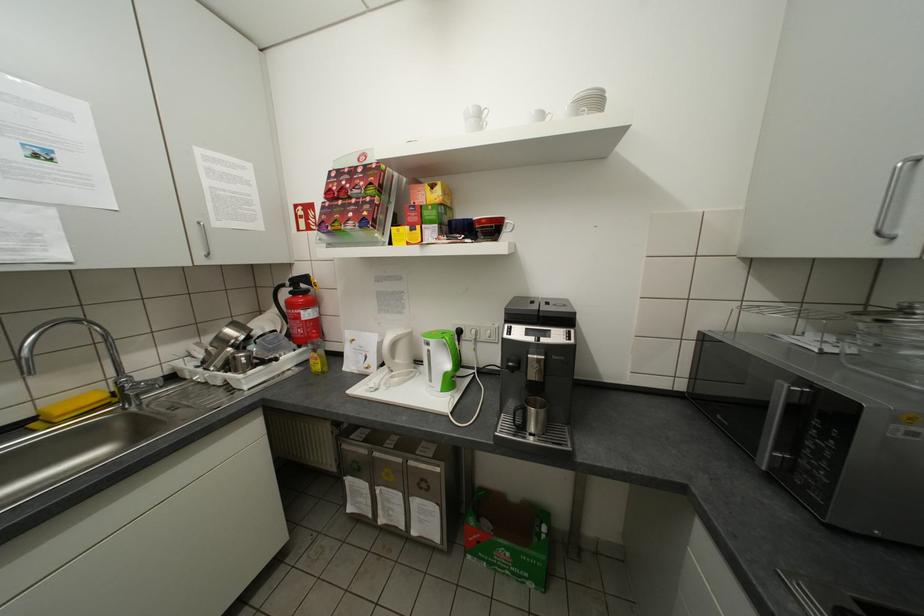
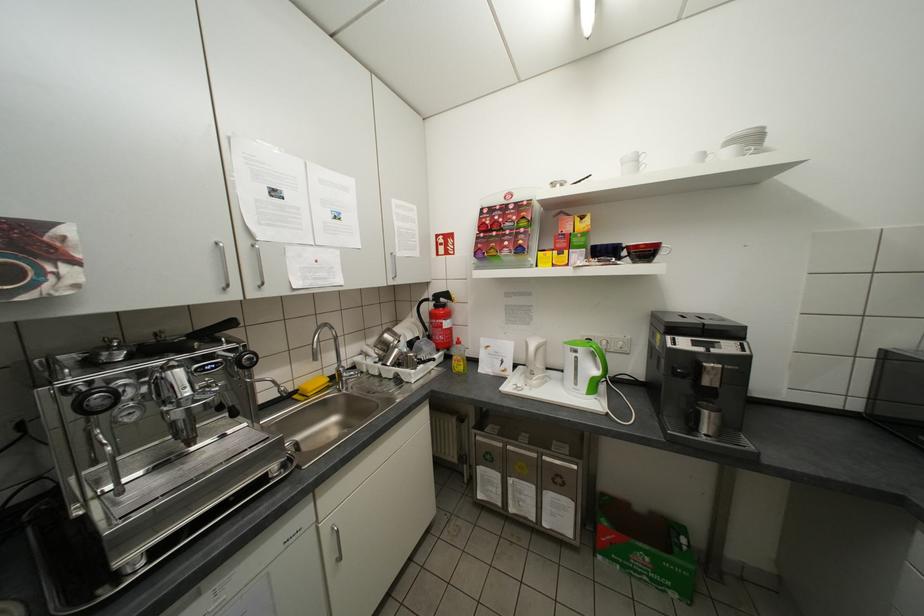
The point at (67, 413) is marked in the first image. Where is the corresponding point in the second image?

(319, 389)